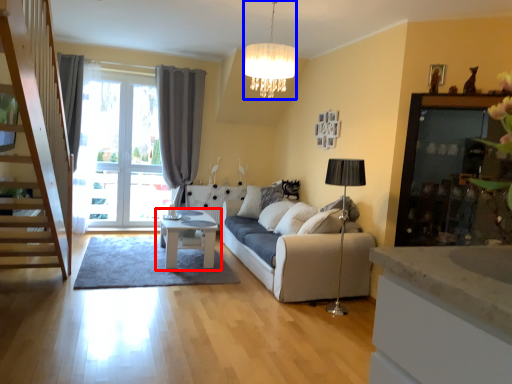
Question: Which of the following is the farthest to the observer, table (highlighted by a red box) or lamp (highlighted by a blue box)?

Choices:
 (A) table
 (B) lamp

Answer: (A)